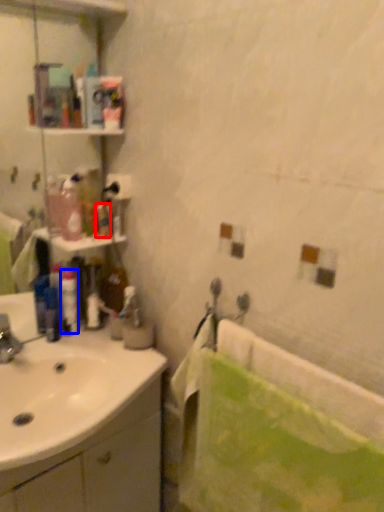
Question: Which point is closer to the camera, toiletry (highlighted by a red box) or toiletry (highlighted by a blue box)?

Choices:
 (A) toiletry
 (B) toiletry

Answer: (A)